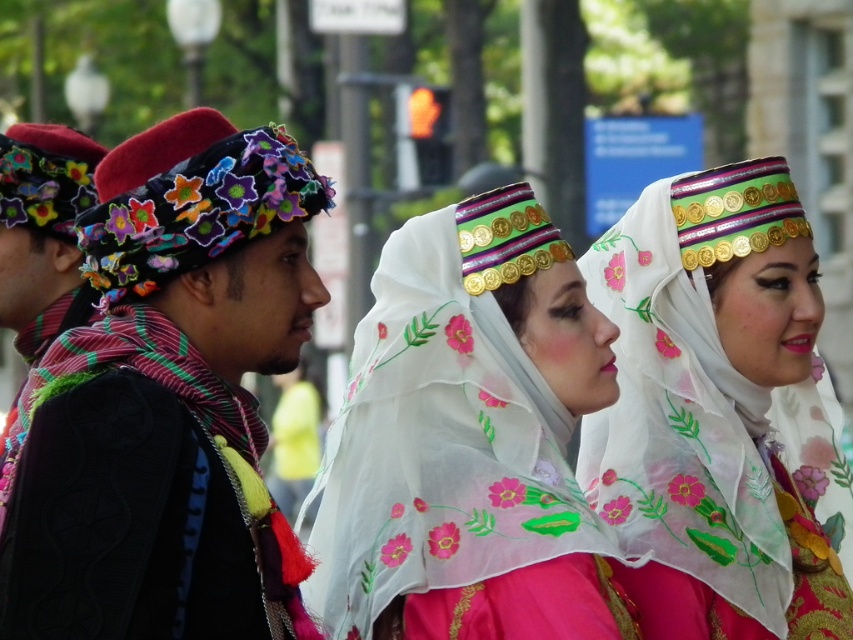
Question: Does multicolored fabric headband at left have a larger size compared to embroidered silk veil at center?

Choices:
 (A) yes
 (B) no

Answer: (A)

Question: Which of these objects is positioned farthest from the multicolored fabric headband at left?

Choices:
 (A) translucent floral veil at center
 (B) embroidered silk veil at center

Answer: (B)

Question: Can you confirm if multicolored fabric headband at left is thinner than embroidered silk veil at center?

Choices:
 (A) yes
 (B) no

Answer: (B)

Question: Among these objects, which one is farthest from the camera?

Choices:
 (A) embroidered silk veil at center
 (B) translucent floral veil at center

Answer: (A)

Question: Based on their relative distances, which object is nearer to the translucent floral veil at center?

Choices:
 (A) multicolored fabric headband at left
 (B) embroidered silk veil at center

Answer: (A)

Question: Is multicolored fabric headband at left wider than embroidered silk veil at center?

Choices:
 (A) no
 (B) yes

Answer: (B)